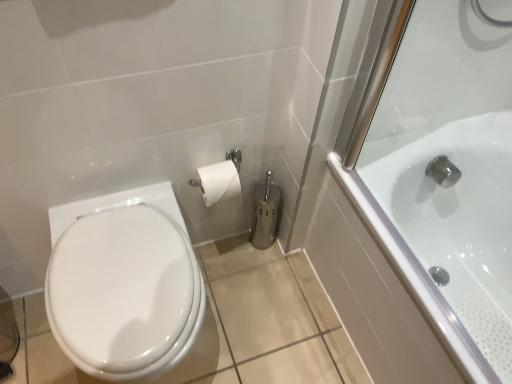
Question: Does white glossy bathtub at right have a lesser height compared to white glossy bidet at lower left?

Choices:
 (A) no
 (B) yes

Answer: (A)

Question: Is white glossy bathtub at right bigger than white glossy bidet at lower left?

Choices:
 (A) no
 (B) yes

Answer: (B)

Question: Does white glossy bathtub at right have a lesser width compared to white glossy bidet at lower left?

Choices:
 (A) no
 (B) yes

Answer: (A)

Question: Would you consider white glossy bathtub at right to be distant from white glossy bidet at lower left?

Choices:
 (A) no
 (B) yes

Answer: (A)

Question: From the image's perspective, is white glossy bathtub at right on white glossy bidet at lower left?

Choices:
 (A) no
 (B) yes

Answer: (B)

Question: From a real-world perspective, is white glossy bathtub at right located beneath white glossy bidet at lower left?

Choices:
 (A) no
 (B) yes

Answer: (B)

Question: From the image's perspective, is white glossy bidet at lower left on white glossy bathtub at right?

Choices:
 (A) yes
 (B) no

Answer: (B)

Question: Is white glossy bidet at lower left outside white glossy bathtub at right?

Choices:
 (A) yes
 (B) no

Answer: (A)

Question: From a real-world perspective, is white glossy bidet at lower left located higher than white glossy bathtub at right?

Choices:
 (A) no
 (B) yes

Answer: (B)

Question: Does white glossy bidet at lower left come behind white glossy bathtub at right?

Choices:
 (A) no
 (B) yes

Answer: (B)

Question: Is white glossy bathtub at right at the back of white glossy bidet at lower left?

Choices:
 (A) yes
 (B) no

Answer: (B)

Question: Is white glossy bathtub at right located within white glossy bidet at lower left?

Choices:
 (A) no
 (B) yes

Answer: (A)

Question: Considering their positions, is white glossy bathtub at right located in front of or behind white glossy bidet at lower left?

Choices:
 (A) behind
 (B) front

Answer: (B)